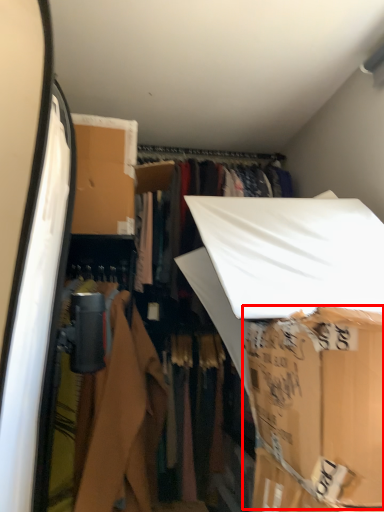
Question: Considering the relative positions of cardboard box (annotated by the red box) and closet in the image provided, where is cardboard box (annotated by the red box) located with respect to the staircase?

Choices:
 (A) right
 (B) left

Answer: (A)